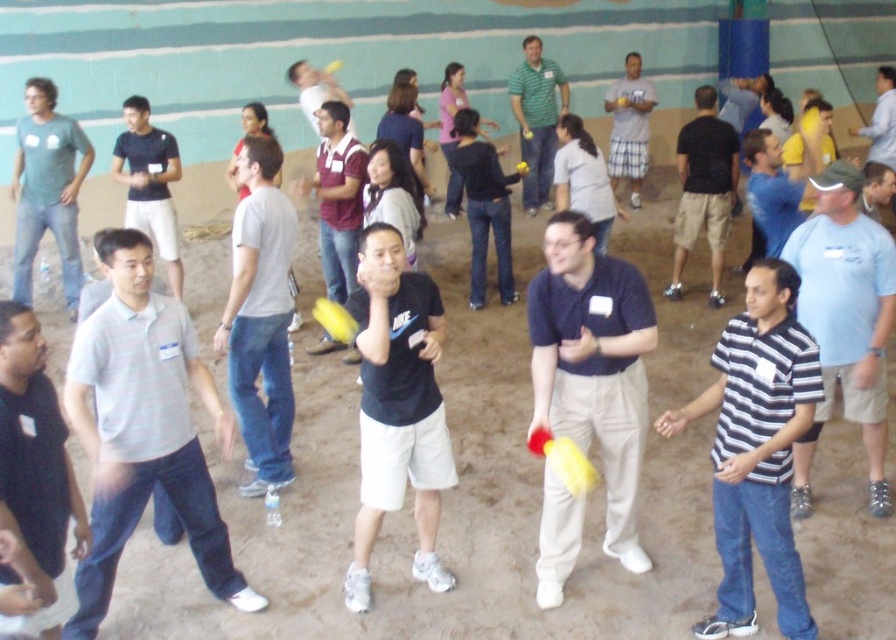
You are organizing a group photo and need to arrange two people based on their shirt widths. The dark gray shirt at left and the light blue shirt at upper right are standing in front of you. Which person should you place on the left side of the photo to maintain a balanced composition?

You should place the dark gray shirt at left on the left side of the photo because it has a lesser width compared to the light blue shirt at upper right, creating a balanced composition by offsetting the wider shirt on the right.